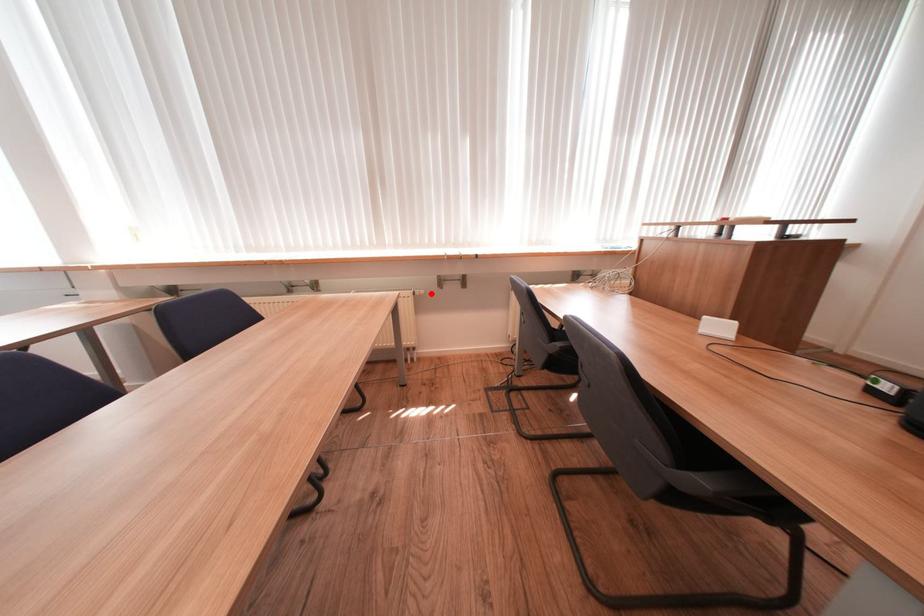
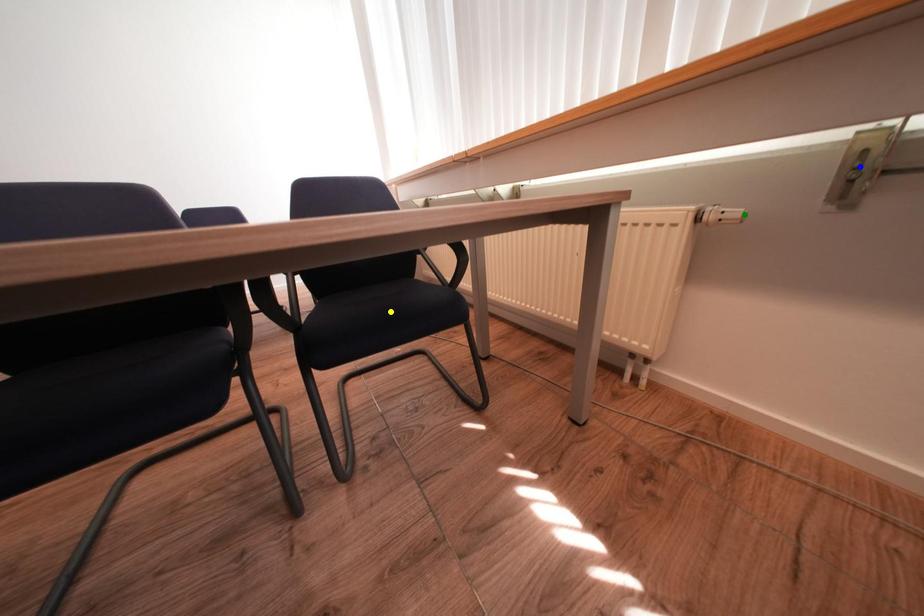
Question: I am providing you with two images of the same scene from different viewpoints. A red point is marked on the first image. You are given multiple points on the second image. In image 2, which mark is for the same physical point as the one in image 1?

Choices:
 (A) yellow point
 (B) blue point
 (C) green point

Answer: (C)